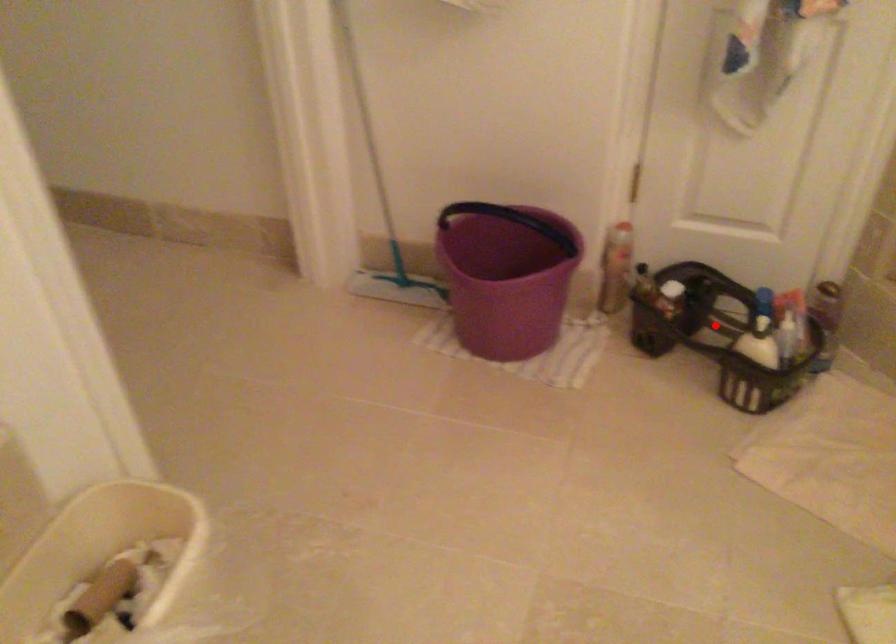
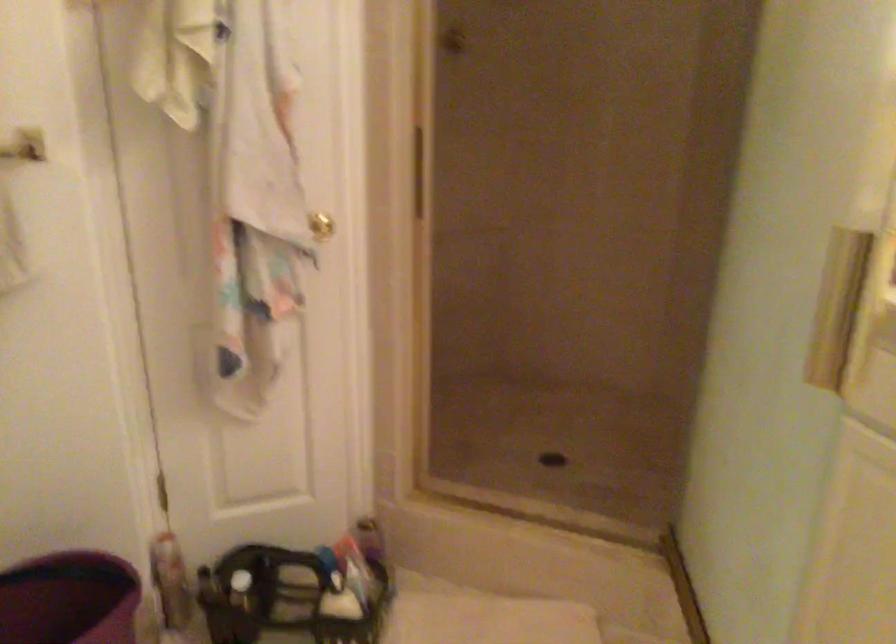
Find the pixel in the second image that matches the highlighted location in the first image.

(281, 598)